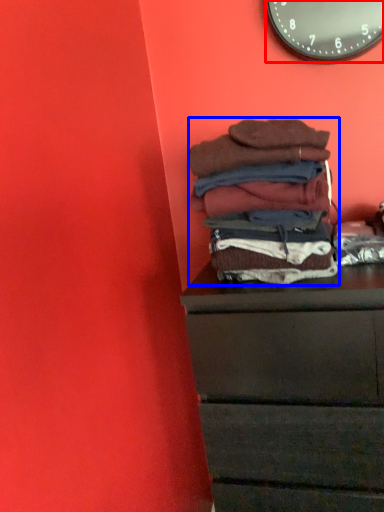
Question: Which object appears closest to the camera in this image, wall clock (highlighted by a red box) or material (highlighted by a blue box)?

Choices:
 (A) wall clock
 (B) material

Answer: (B)